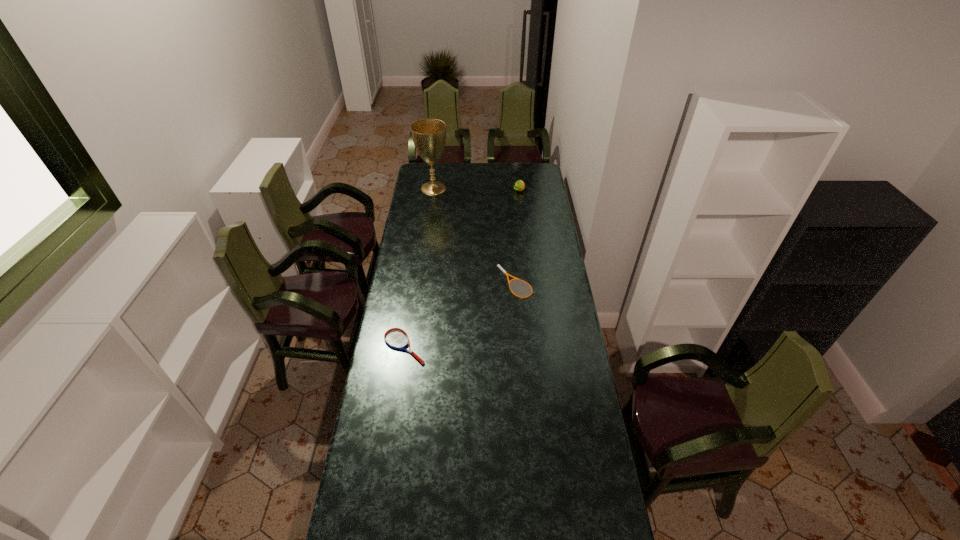
This screenshot has height=540, width=960. What are the coordinates of `free space between the third farthest object and the lemon` in the screenshot? It's located at (517, 237).

Where is `free space between the second tallest object and the left tennis racket`? free space between the second tallest object and the left tennis racket is located at coordinates (462, 268).

This screenshot has height=540, width=960. What are the coordinates of `blank region between the second tallest object and the nearer tennis racket` in the screenshot? It's located at (462, 268).

Where is `vacant space that's between the trophy cup and the nearest object`? vacant space that's between the trophy cup and the nearest object is located at coordinates (419, 267).

This screenshot has width=960, height=540. In order to click on vacant space that is in between the right tennis racket and the nearer tennis racket in this screenshot , I will do `click(460, 315)`.

Image resolution: width=960 pixels, height=540 pixels. I want to click on vacant region between the left tennis racket and the second tallest object, so click(x=462, y=268).

What are the coordinates of `free spot between the second tallest object and the tallest object` in the screenshot? It's located at (476, 189).

The width and height of the screenshot is (960, 540). I want to click on blank region between the nearest object and the trophy cup, so (419, 267).

Identify the location of vacant area that lies between the left tennis racket and the third farthest object. (460, 315).

Locate an element on the screen. The width and height of the screenshot is (960, 540). the second closest object relative to the farther tennis racket is located at coordinates (519, 185).